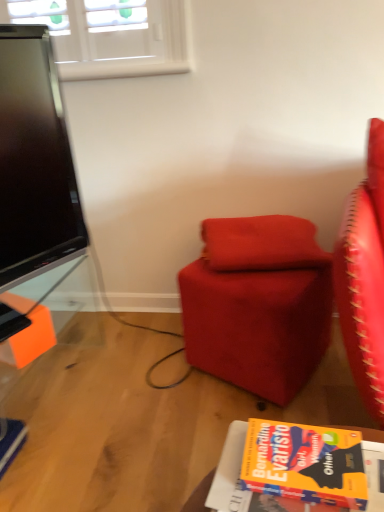
Question: Can you confirm if velvet red pillow at center is shorter than suede-like red ottoman at center?

Choices:
 (A) yes
 (B) no

Answer: (A)

Question: Does velvet red pillow at center appear on the right side of suede-like red ottoman at center?

Choices:
 (A) no
 (B) yes

Answer: (B)

Question: Is velvet red pillow at center turned away from suede-like red ottoman at center?

Choices:
 (A) yes
 (B) no

Answer: (B)

Question: Is the depth of velvet red pillow at center greater than that of suede-like red ottoman at center?

Choices:
 (A) yes
 (B) no

Answer: (A)

Question: Is velvet red pillow at center outside suede-like red ottoman at center?

Choices:
 (A) yes
 (B) no

Answer: (A)

Question: Is velvet red pillow at center far away from suede-like red ottoman at center?

Choices:
 (A) yes
 (B) no

Answer: (B)

Question: Is orange matte book at lower right at the left side of suede-like red ottoman at center?

Choices:
 (A) no
 (B) yes

Answer: (B)

Question: Is orange matte book at lower right not inside suede-like red ottoman at center?

Choices:
 (A) no
 (B) yes

Answer: (B)

Question: From the image's perspective, does orange matte book at lower right appear higher than suede-like red ottoman at center?

Choices:
 (A) yes
 (B) no

Answer: (B)

Question: Does orange matte book at lower right have a larger size compared to suede-like red ottoman at center?

Choices:
 (A) no
 (B) yes

Answer: (A)

Question: Is orange matte book at lower right far from suede-like red ottoman at center?

Choices:
 (A) no
 (B) yes

Answer: (A)

Question: Can you confirm if orange matte book at lower right is thinner than suede-like red ottoman at center?

Choices:
 (A) no
 (B) yes

Answer: (B)

Question: Can you confirm if suede-like red ottoman at center is thinner than velvet red pillow at center?

Choices:
 (A) no
 (B) yes

Answer: (A)